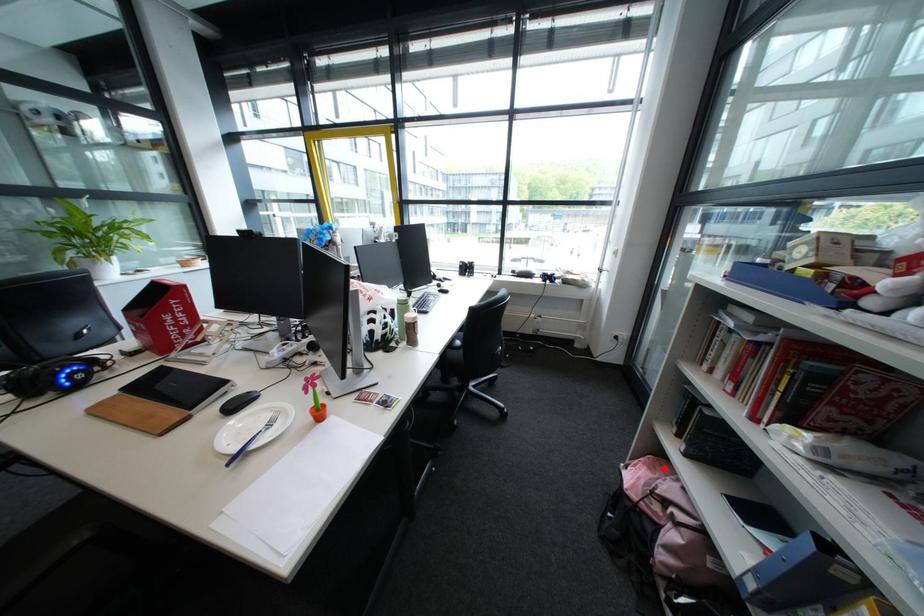
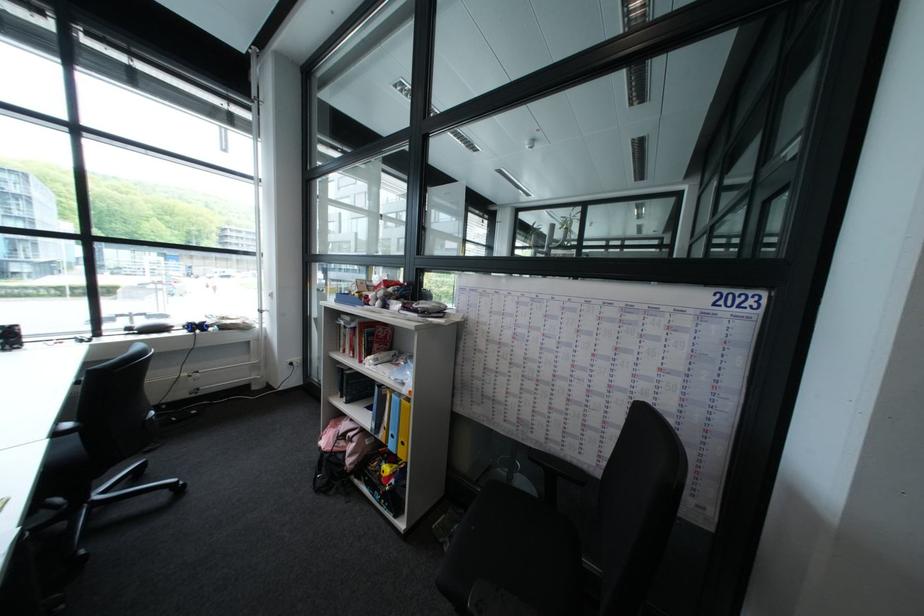
The point at the highlighted location is marked in the first image. Where is the corresponding point in the second image?

(348, 428)